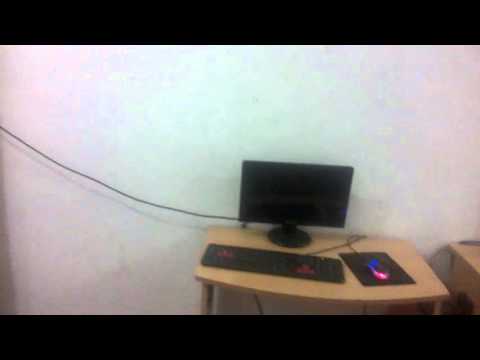
You are a GUI agent. You are given a task and a screenshot of the screen. Output one action in this format:
    pyautogui.click(x=<x>, y=<y>)
    Task: Click on the monitor
    The image size is (480, 360).
    Given the screenshot: What is the action you would take?
    pyautogui.click(x=305, y=188)